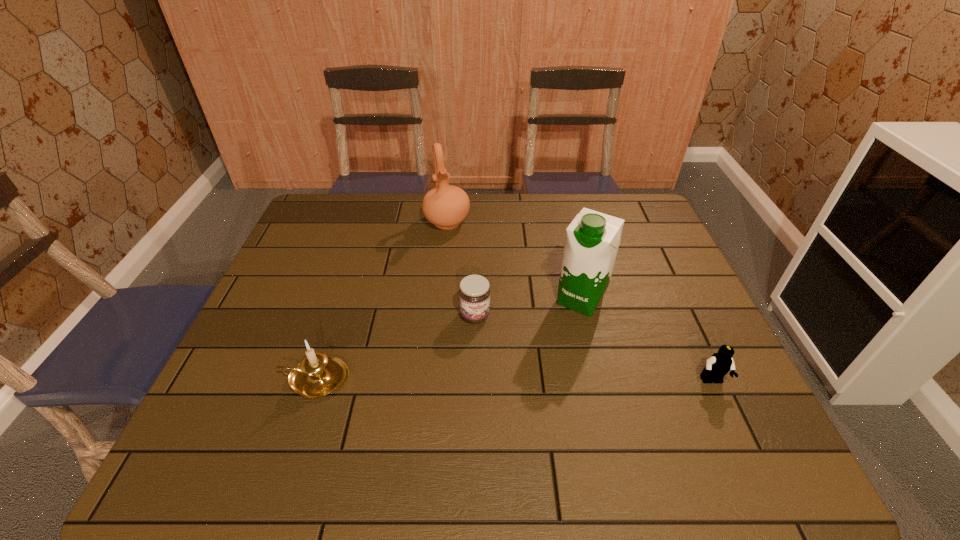
I want to click on Lego that is positioned at the near edge, so click(x=719, y=364).

I want to click on object positioned at the left edge, so click(x=317, y=375).

You are a GUI agent. You are given a task and a screenshot of the screen. Output one action in this format:
    pyautogui.click(x=<x>, y=<y>)
    Task: Click on the object located at the right edge
    
    Given the screenshot: What is the action you would take?
    pyautogui.click(x=719, y=364)

At what (x,y) coordinates should I click in order to perform the action: click on object that is at the near left corner. Please return your answer as a coordinate pair (x, y). The width and height of the screenshot is (960, 540). Looking at the image, I should click on (317, 375).

Locate an element on the screen. The image size is (960, 540). object located in the near right corner section of the desktop is located at coordinates (719, 364).

The width and height of the screenshot is (960, 540). I want to click on free spot at the far edge of the desktop, so pyautogui.click(x=520, y=215).

This screenshot has height=540, width=960. In the image, there is a desktop. In order to click on free space at the near edge in this screenshot , I will do `click(335, 415)`.

At what (x,y) coordinates should I click in order to perform the action: click on vacant space at the left edge of the desktop. Please return your answer as a coordinate pair (x, y). The width and height of the screenshot is (960, 540). Looking at the image, I should click on (338, 244).

Locate an element on the screen. The height and width of the screenshot is (540, 960). vacant space at the right edge of the desktop is located at coordinates (691, 318).

The image size is (960, 540). In the image, there is a desktop. Find the location of `vacant space at the far left corner`. vacant space at the far left corner is located at coordinates (346, 198).